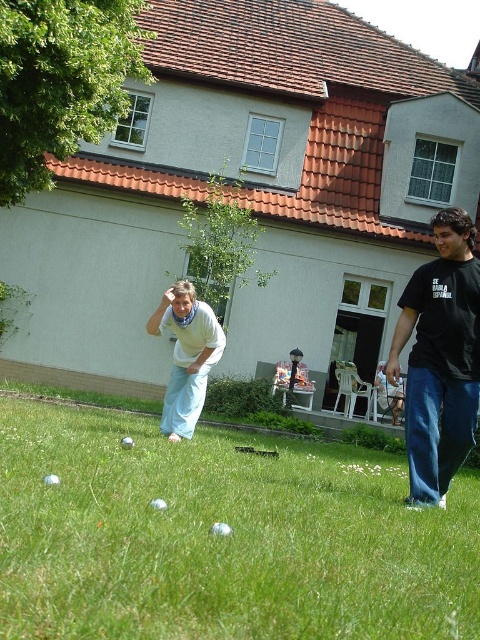
You are standing at the point marked by coordinates point [220,538]. Looking around, you see the green grass at center. Which direction should you walk to reach the house in the background?

The green grass at center is located at point [220,538]. Since the house is in the background, you should walk away from the green grass at center towards the direction where the house is situated, which is likely behind the current position relative to the scene.